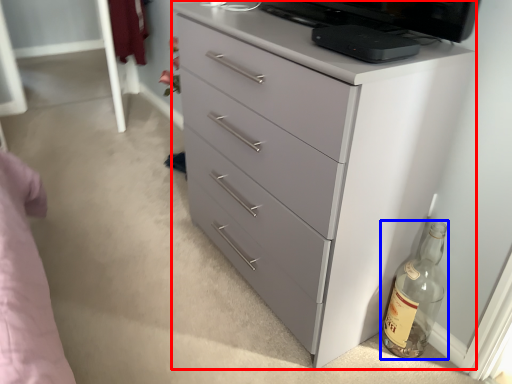
Question: Which object appears closest to the camera in this image, chest of drawers (highlighted by a red box) or bottle (highlighted by a blue box)?

Choices:
 (A) chest of drawers
 (B) bottle

Answer: (A)